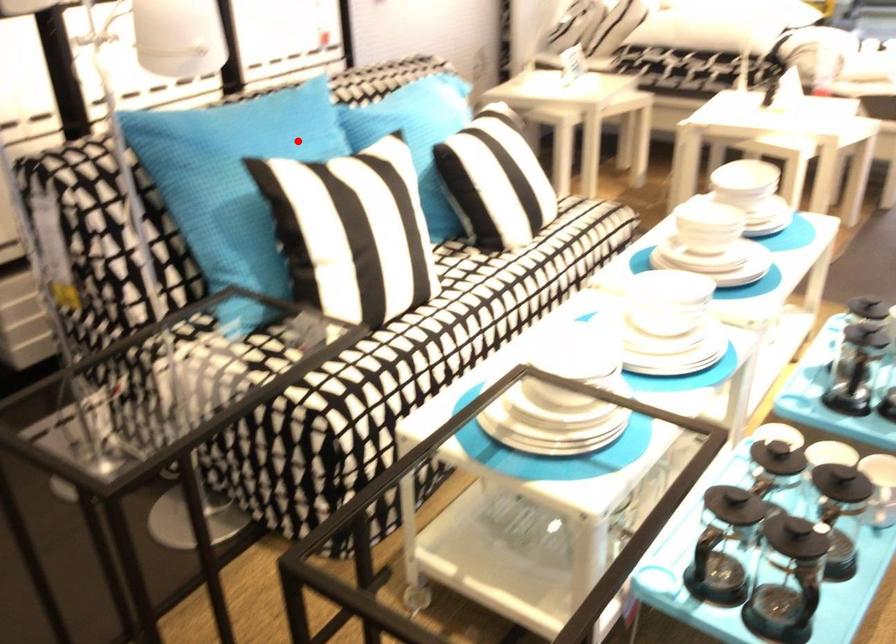
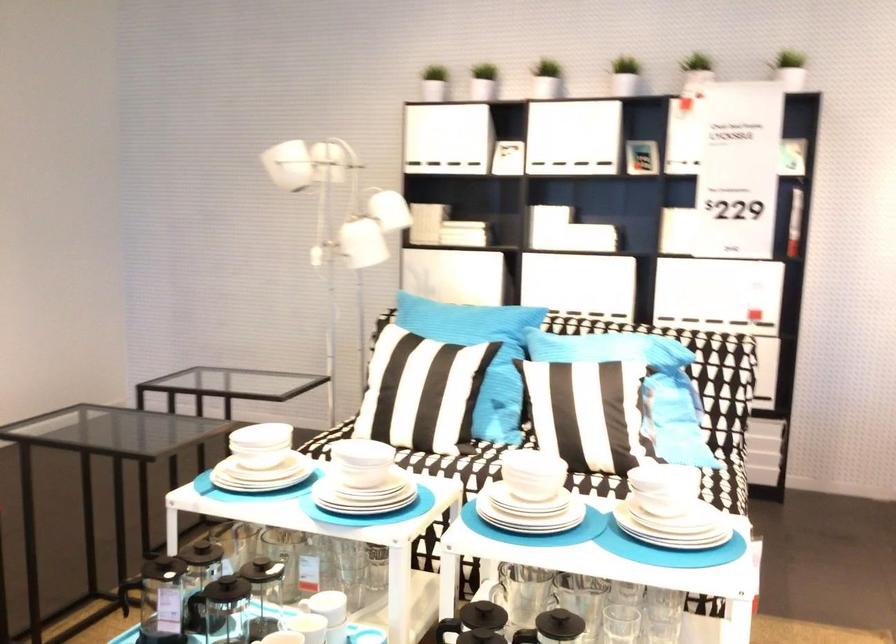
Question: I am providing you with two images of the same scene from different viewpoints. Image1 has a red point marked. In image2, the corresponding 3D location appears at what relative position? Reply with the corresponding letter.

Choices:
 (A) Closer
 (B) Farther

Answer: (B)